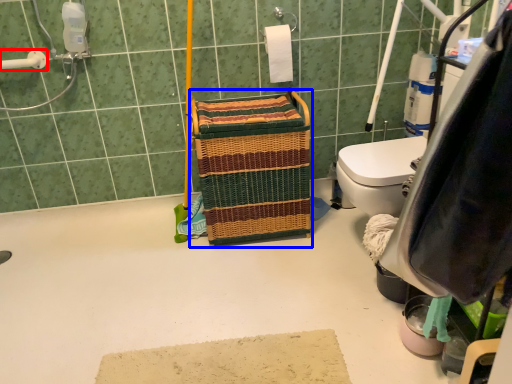
Question: Which object appears farthest to the camera in this image, shower (highlighted by a red box) or laundry basket (highlighted by a blue box)?

Choices:
 (A) shower
 (B) laundry basket

Answer: (A)